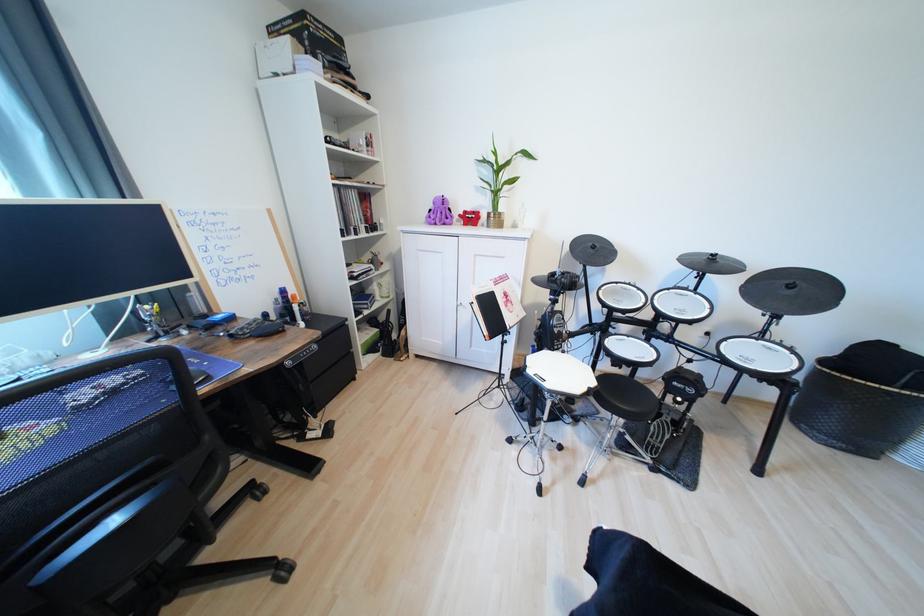
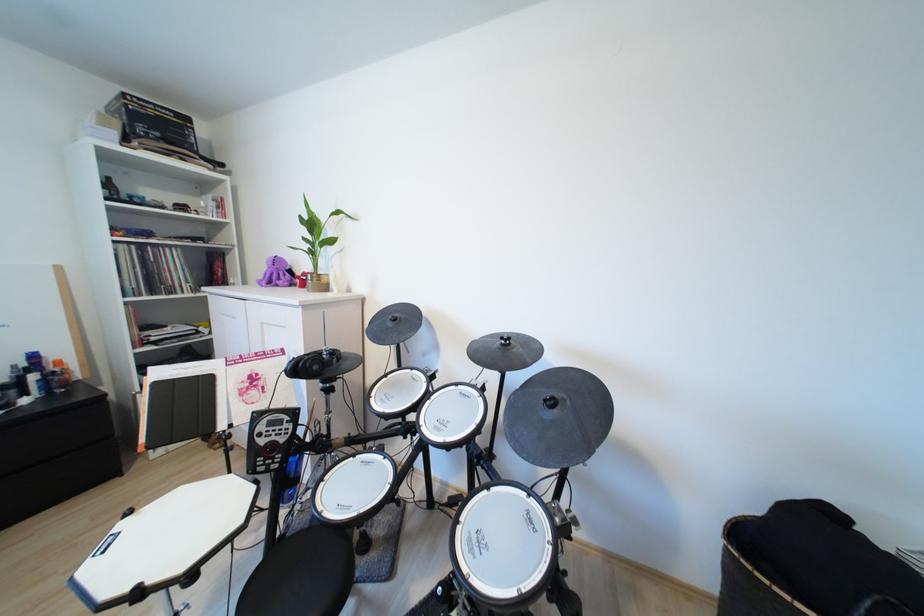
Where in the second image is the point corresponding to point 797,288 from the first image?

(560, 405)